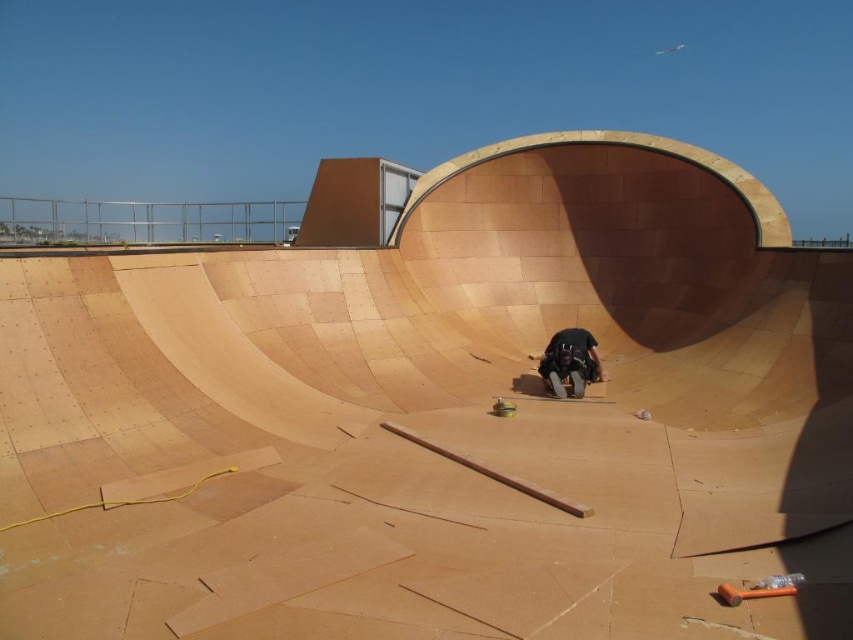
Question: Does black matte skateboarder at center have a smaller size compared to smooth brown skateboard at center?

Choices:
 (A) no
 (B) yes

Answer: (A)

Question: Is black matte skateboarder at center smaller than smooth brown skateboard at center?

Choices:
 (A) yes
 (B) no

Answer: (B)

Question: Can you confirm if black matte skateboarder at center is smaller than smooth brown skateboard at center?

Choices:
 (A) yes
 (B) no

Answer: (B)